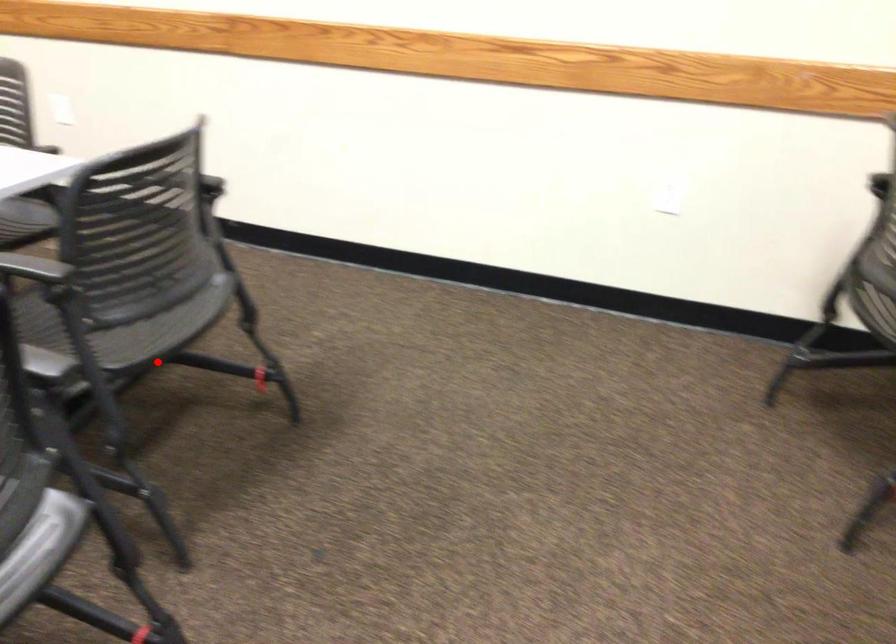
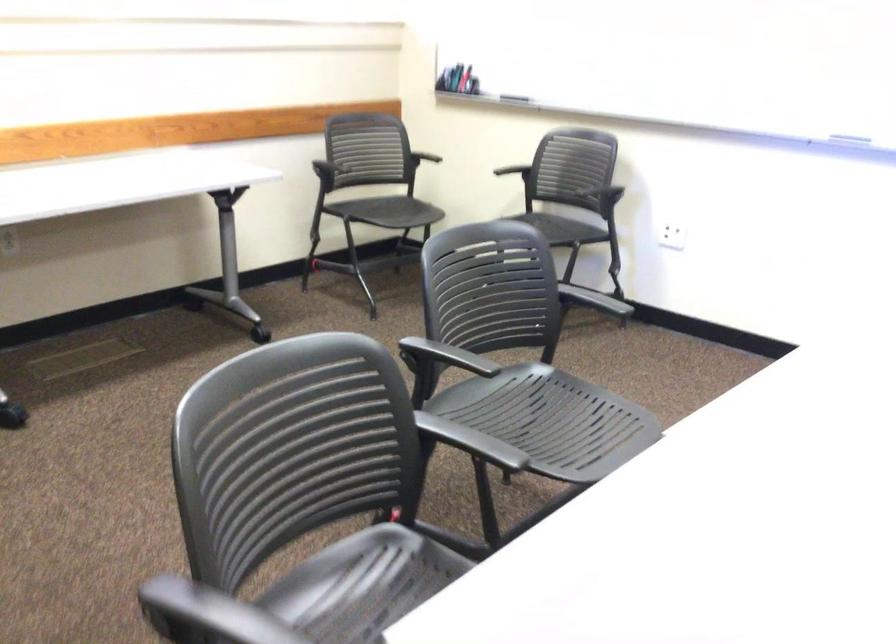
The point at the highlighted location is marked in the first image. Where is the corresponding point in the second image?

(362, 585)